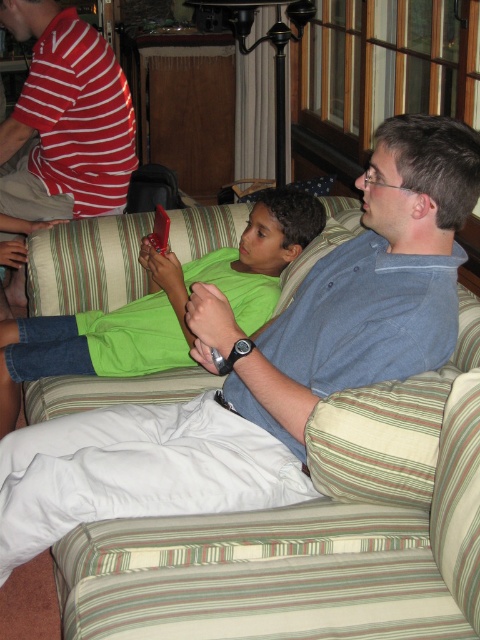
Question: Does red striped shirt at upper left appear over rubberized plastic phone at center?

Choices:
 (A) no
 (B) yes

Answer: (B)

Question: Which object is closer to the camera taking this photo?

Choices:
 (A) green matte shirt at center
 (B) green striped fabric couch at center
 (C) red striped shirt at upper left

Answer: (B)

Question: Can you confirm if green striped fabric couch at center is bigger than rubberized plastic phone at center?

Choices:
 (A) yes
 (B) no

Answer: (A)

Question: Which object appears farthest from the camera in this image?

Choices:
 (A) green striped fabric couch at center
 (B) green matte shirt at center
 (C) rubberized plastic phone at center
 (D) red striped shirt at upper left

Answer: (D)

Question: Can you confirm if green striped fabric couch at center is wider than rubberized plastic phone at center?

Choices:
 (A) no
 (B) yes

Answer: (B)

Question: Estimate the real-world distances between objects in this image. Which object is farther from the green matte shirt at center?

Choices:
 (A) red striped shirt at upper left
 (B) rubberized plastic phone at center
 (C) green striped fabric couch at center

Answer: (A)